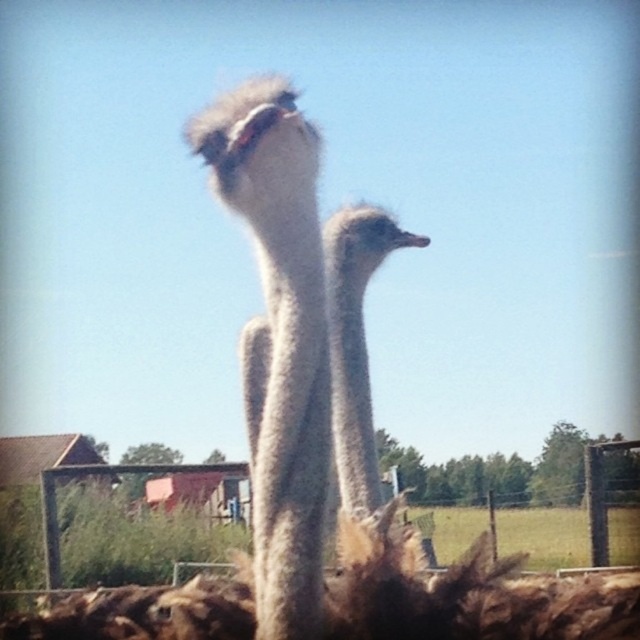
Question: Is metal wire fence at center to the right of white feathered ostrich at center from the viewer's perspective?

Choices:
 (A) yes
 (B) no

Answer: (A)

Question: Based on their relative distances, which object is nearer to the white fluffy head at upper center?

Choices:
 (A) white feathered ostrich at center
 (B) metal wire fence at center

Answer: (A)

Question: Is metal wire fence at center positioned in front of white feathered ostrich at center?

Choices:
 (A) no
 (B) yes

Answer: (A)

Question: In this image, where is metal wire fence at center located relative to white fluffy head at upper center?

Choices:
 (A) above
 (B) below

Answer: (B)

Question: Among these objects, which one is farthest from the camera?

Choices:
 (A) white feathered ostrich at center
 (B) metal wire fence at center
 (C) white fluffy head at upper center

Answer: (B)

Question: Which point is closer to the camera taking this photo?

Choices:
 (A) (333, 388)
 (B) (61, 550)

Answer: (A)